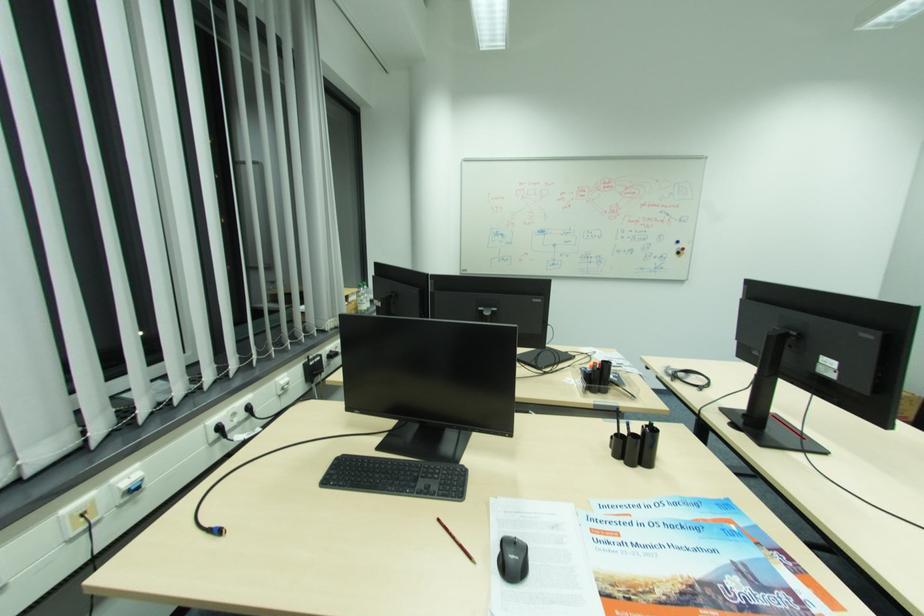
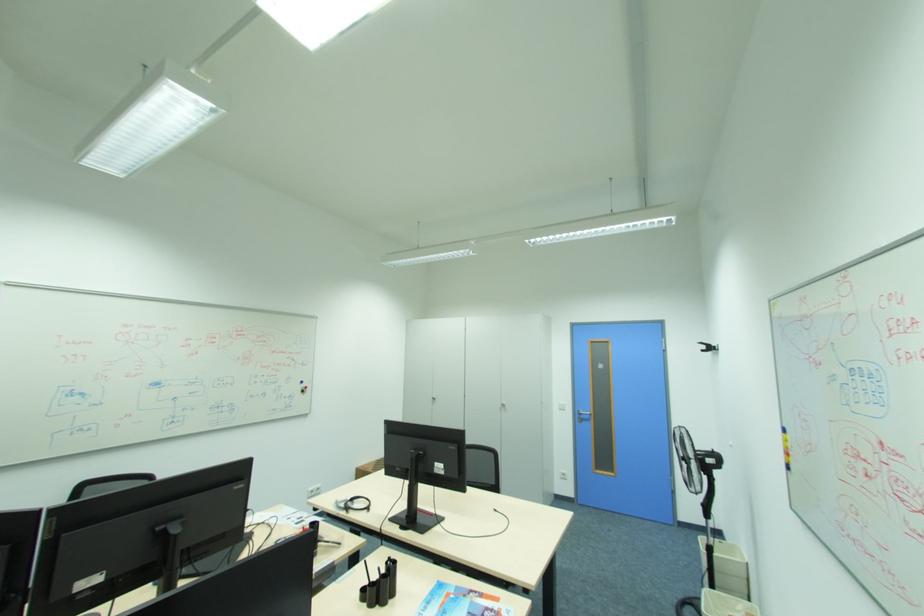
Where in the second image is the point corresponding to (x=686, y=374) from the first image?

(355, 505)